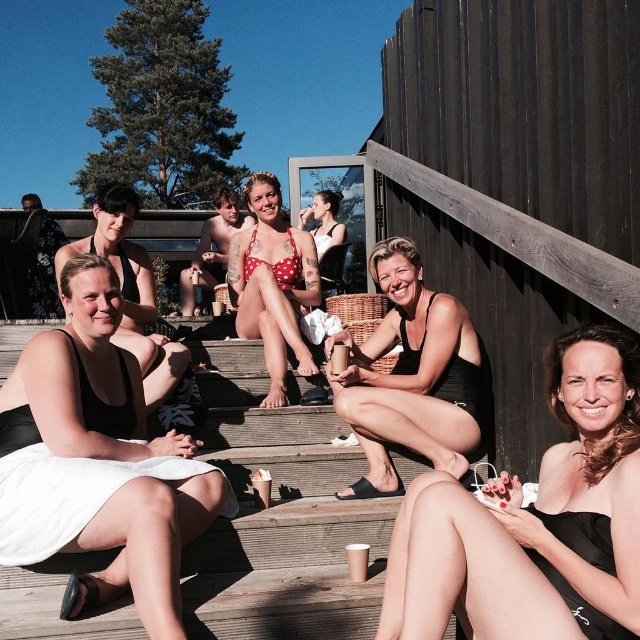
You are standing at the bottom of the wooden deck steps and want to place a black matte towel somewhere near the steps. Is there already a black matte towel at lower left near the steps?

Yes, there is already a black matte towel at lower left near the steps located at point (99,461).

You are standing at the bottom of the wooden deck steps and want to walk towards the building with dark, corrugated metal siding. Which point, point [403,630] or point [310,216], is closer to you as you start walking?

Point [403,630] is closer to the viewer than point [310,216], so it will be closer to you as you start walking.

You are a photographer taking a photo of the black matte swimsuit at lower right and the polka dot bikini at center. Which swimwear is wider in the image?

The black matte swimsuit at lower right is wider than the polka dot bikini at center.